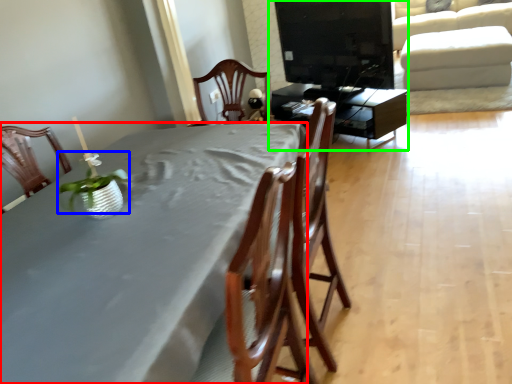
Question: Based on their relative distances, which object is farther from table (highlighted by a red box)? Choose from plant (highlighted by a blue box) and entertainment center (highlighted by a green box).

Choices:
 (A) plant
 (B) entertainment center

Answer: (B)